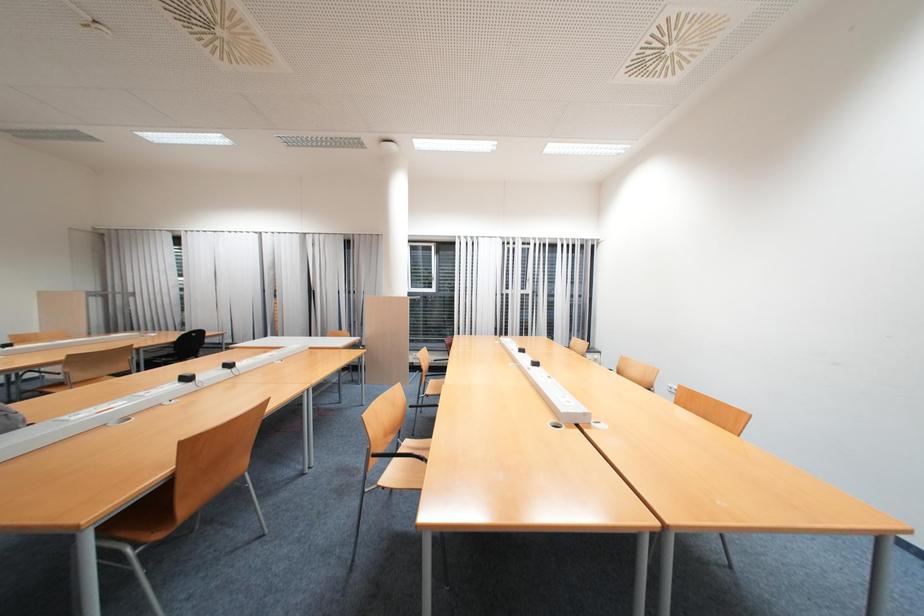
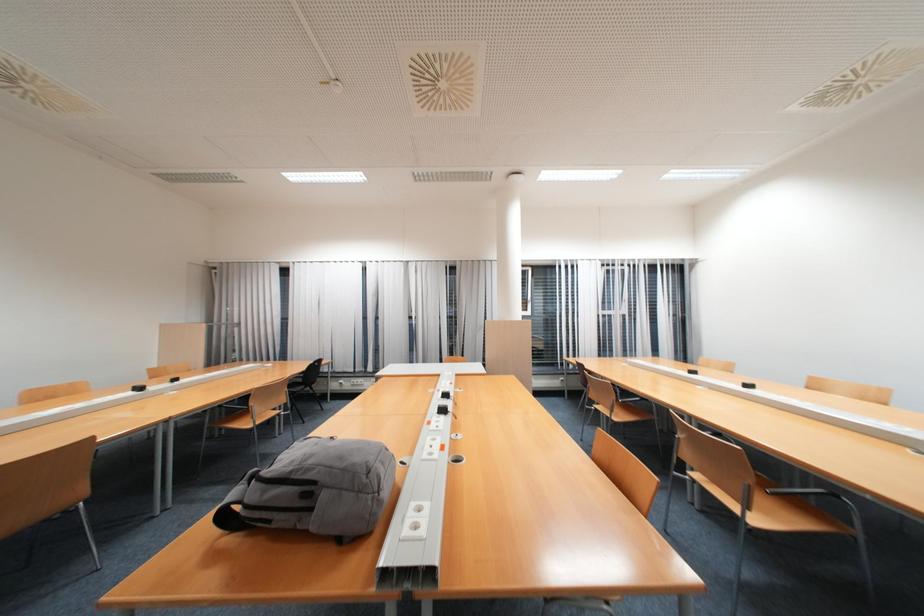
Question: The images are taken continuously from a first-person perspective. In which direction are you moving?

Choices:
 (A) Left
 (B) Right
 (C) Forward
 (D) Backward

Answer: (A)